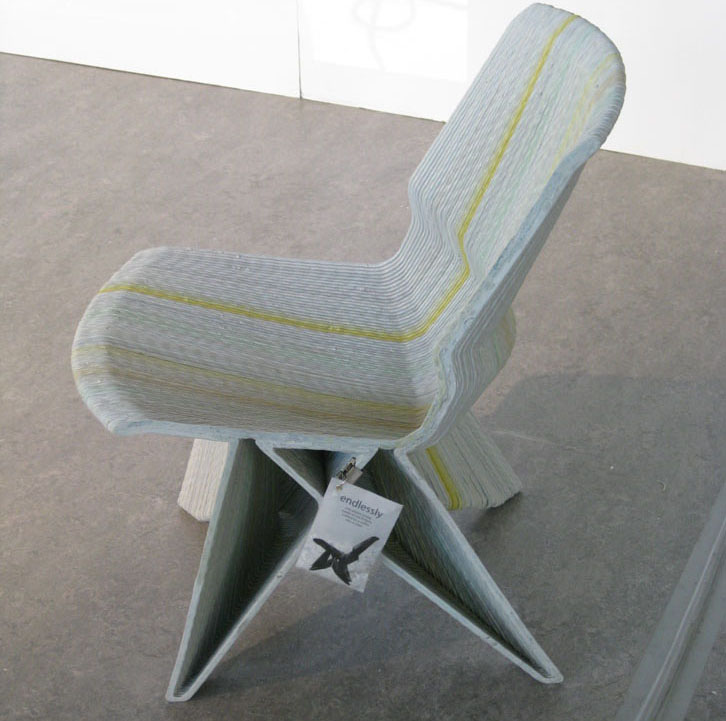
Identify the location of front end of seat of chair. This screenshot has width=726, height=721. (73, 352).